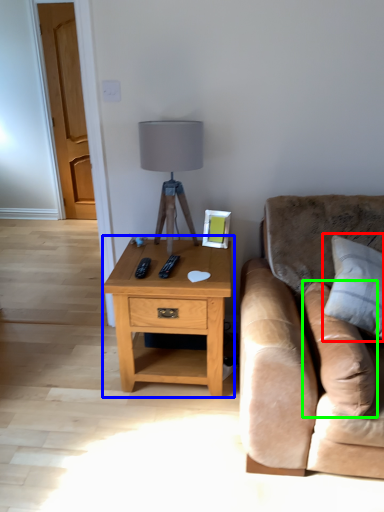
Question: Which is nearer to the pillow (highlighted by a red box)? nightstand (highlighted by a blue box) or pillow (highlighted by a green box).

Choices:
 (A) nightstand
 (B) pillow

Answer: (B)